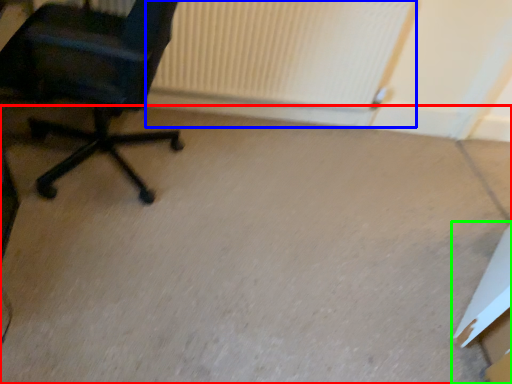
Question: Which object is positioned farthest from concrete (highlighted by a red box)? Select from radiator (highlighted by a blue box) and cardboard box (highlighted by a green box).

Choices:
 (A) radiator
 (B) cardboard box

Answer: (A)